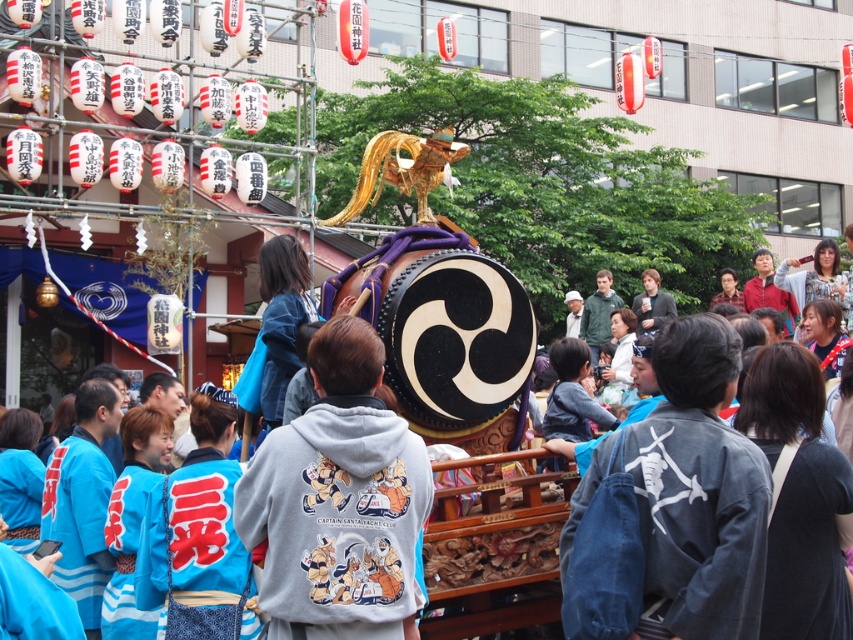
Question: Which is nearer to the denim jacket at lower right?

Choices:
 (A) gray hoodie at center
 (B) matte black jacket at center
 (C) green fabric jacket at center
 (D) black polished drum at center

Answer: (D)

Question: Can you confirm if denim jacket at lower right is thinner than green fabric jacket at center?

Choices:
 (A) yes
 (B) no

Answer: (B)

Question: Estimate the real-world distances between objects in this image. Which object is farther from the denim jacket at lower right?

Choices:
 (A) green fabric jacket at center
 (B) black polished drum at center

Answer: (A)

Question: Which of the following is the closest to the observer?

Choices:
 (A) black polished drum at center
 (B) matte black jacket at center

Answer: (A)

Question: Is gray hoodie at center wider than matte black jacket at center?

Choices:
 (A) yes
 (B) no

Answer: (B)

Question: Is gray hoodie at center behind green fabric jacket at center?

Choices:
 (A) no
 (B) yes

Answer: (A)